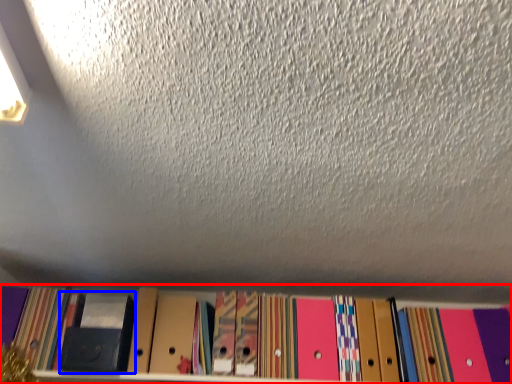
Question: Which point is closer to the camera, shelf (highlighted by a red box) or paperback book (highlighted by a blue box)?

Choices:
 (A) shelf
 (B) paperback book

Answer: (A)